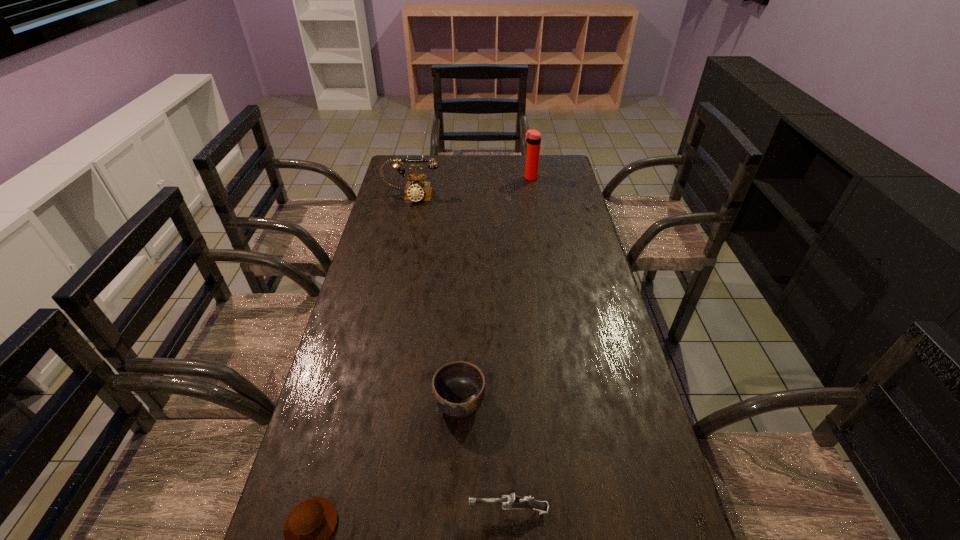
Where is `free space located 0.240m aimed along the barrel of the gun`? This screenshot has height=540, width=960. free space located 0.240m aimed along the barrel of the gun is located at coordinates (352, 510).

Locate an element on the screen. vacant space located 0.310m aimed along the barrel of the gun is located at coordinates (319, 510).

Image resolution: width=960 pixels, height=540 pixels. Find the location of `free space located aimed along the barrel of the gun`. free space located aimed along the barrel of the gun is located at coordinates (372, 510).

Find the location of `object that is at the far edge`. object that is at the far edge is located at coordinates (533, 137).

I want to click on object located at the left edge, so click(416, 190).

The image size is (960, 540). I want to click on object that is at the right edge, so click(x=533, y=137).

Image resolution: width=960 pixels, height=540 pixels. What are the coordinates of `object that is positioned at the far right corner` in the screenshot? It's located at (533, 137).

Image resolution: width=960 pixels, height=540 pixels. I want to click on free point at the left edge, so click(340, 525).

The image size is (960, 540). Identify the location of vacant region at the right edge of the desktop. (551, 184).

The image size is (960, 540). Identify the location of free space at the far left corner. (395, 171).